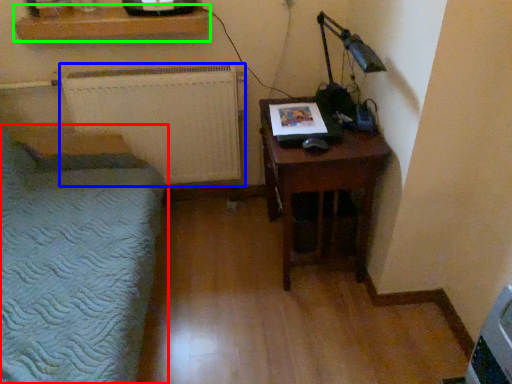
Question: Considering the real-world distances, which object is closest to furniture (highlighted by a red box)? radiator (highlighted by a blue box) or shelf (highlighted by a green box).

Choices:
 (A) radiator
 (B) shelf

Answer: (A)